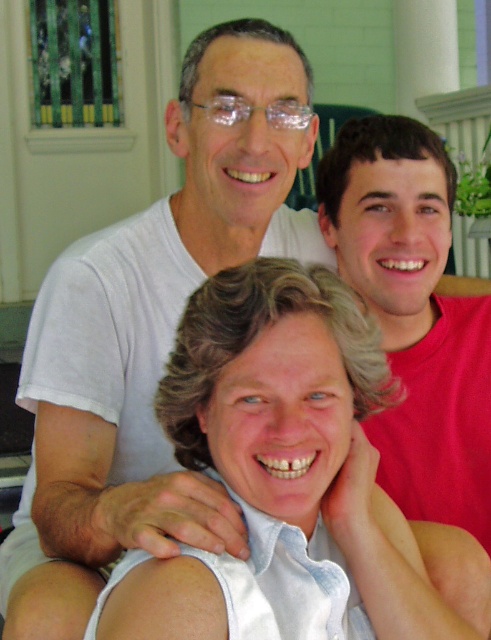
Question: Which object is the farthest from the white matte t-shirt at upper center?

Choices:
 (A) gray silk shirt at center
 (B) red matte shirt at upper right

Answer: (B)

Question: Estimate the real-world distances between objects in this image. Which object is farther from the red matte shirt at upper right?

Choices:
 (A) gray silk shirt at center
 (B) white matte t-shirt at upper center

Answer: (A)

Question: Does gray silk shirt at center appear under red matte shirt at upper right?

Choices:
 (A) yes
 (B) no

Answer: (A)

Question: Which of the following is the farthest from the observer?

Choices:
 (A) (417, 144)
 (B) (127, 580)
 (C) (62, 385)

Answer: (A)

Question: Does gray silk shirt at center have a greater width compared to red matte shirt at upper right?

Choices:
 (A) yes
 (B) no

Answer: (A)

Question: Does white matte t-shirt at upper center appear on the left side of gray silk shirt at center?

Choices:
 (A) no
 (B) yes

Answer: (B)